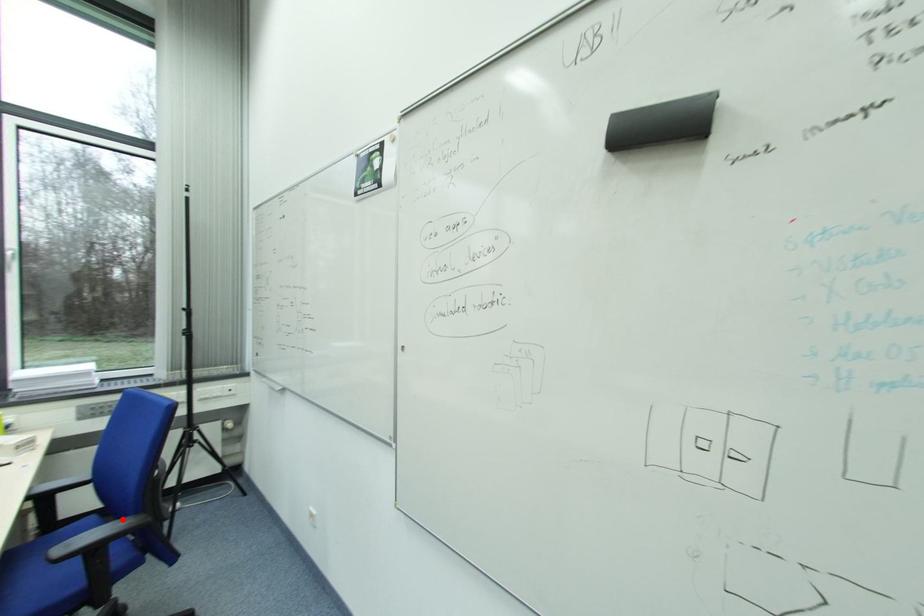
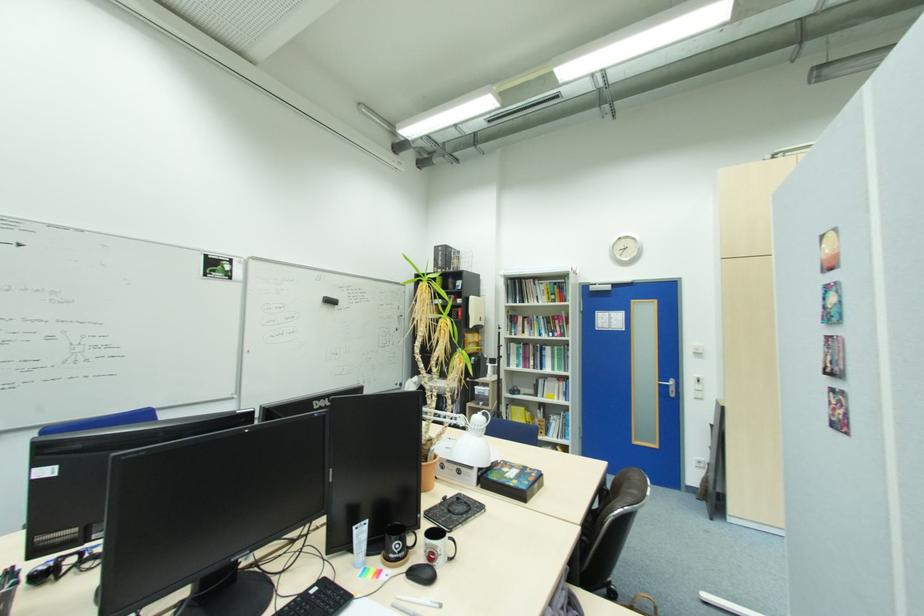
Question: I am providing you with two images of the same scene from different viewpoints. A red point is marked on the first image. At the location where the point appears in image 1, is it still visible in image 2?

Choices:
 (A) Yes
 (B) No

Answer: (B)